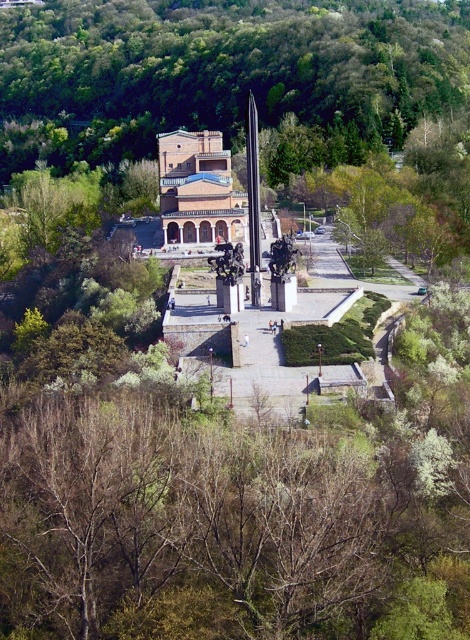
You are planning to install a new pathway in the park that needs to be exactly 100 meters long. You have the option to place it between the green leafy trees at center and the brick textured church at center. Based on the given information, will this pathway fit perfectly between them?

The distance between the green leafy trees at center and the brick textured church at center is 110.88 meters, which is longer than the 100 meter pathway. Therefore, the pathway will not fit perfectly between them as there will be an excess of 10.88 meters.

You are standing in the plaza and want to take a photo of both the green leafy trees at center and the brick textured church at center. Which direction should you face to ensure both are in your camera frame?

You should face to the left so that both the green leafy trees at center and the brick textured church at center are visible in your frame, as the green leafy trees at center is positioned to the right of the brick textured church at center.